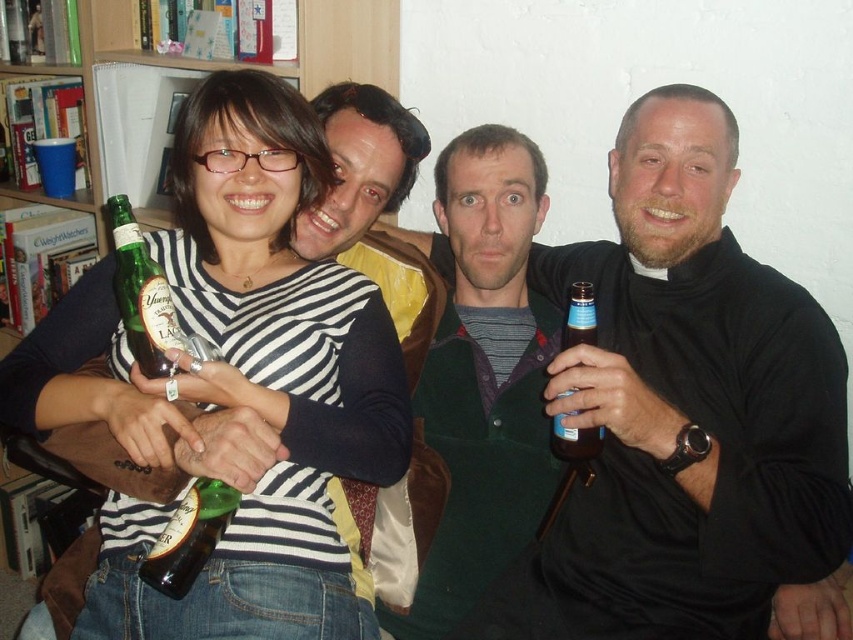
Between point (469, 275) and point (149, 333), which one is positioned behind?

The point (469, 275) is more distant.

What do you see at coordinates (483, 372) in the screenshot?
I see `green wool sweater at center` at bounding box center [483, 372].

At what (x,y) coordinates should I click in order to perform the action: click on green wool sweater at center. Please return your answer as a coordinate pair (x, y). The width and height of the screenshot is (853, 640). Looking at the image, I should click on (483, 372).

Can you confirm if smooth brown leather jacket at center is bigger than green glass bottle at left?

Yes, smooth brown leather jacket at center is bigger than green glass bottle at left.

Does smooth brown leather jacket at center come behind green glass bottle at left?

Yes, it is behind green glass bottle at left.

Where is `smooth brown leather jacket at center`? This screenshot has height=640, width=853. smooth brown leather jacket at center is located at coordinates (683, 410).

This screenshot has width=853, height=640. What do you see at coordinates (141, 294) in the screenshot? I see `green glass bottle at left` at bounding box center [141, 294].

This screenshot has width=853, height=640. Identify the location of green glass bottle at left. (141, 294).